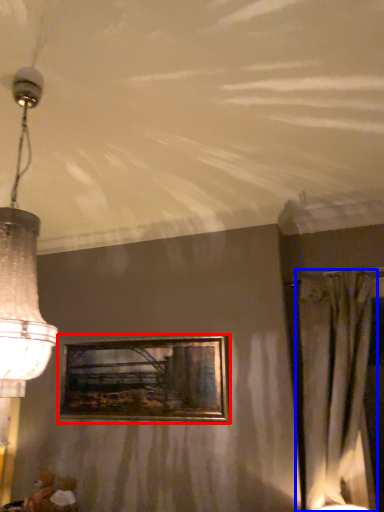
Question: Which point is closer to the camera, picture frame (highlighted by a red box) or curtain (highlighted by a blue box)?

Choices:
 (A) picture frame
 (B) curtain

Answer: (B)